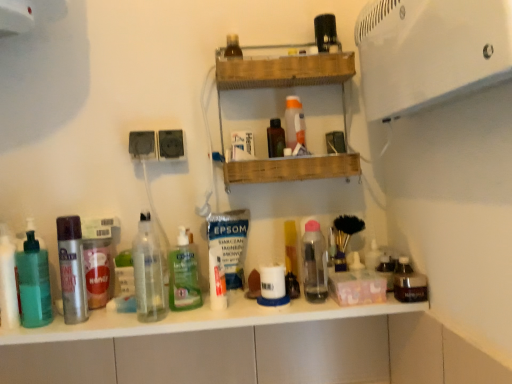
Question: Considering the relative sizes of clear glass bottle at center, the 3th bottle from the left, and silver metallic spray can at left, marked as the fourth bottle in a right-to-left arrangement, in the image provided, is clear glass bottle at center, the 3th bottle from the left, bigger than silver metallic spray can at left, marked as the fourth bottle in a right-to-left arrangement,?

Choices:
 (A) yes
 (B) no

Answer: (A)

Question: Is clear glass bottle at center, the third bottle viewed from the right, placed right next to silver metallic spray can at left, marked as the fourth bottle in a right-to-left arrangement?

Choices:
 (A) yes
 (B) no

Answer: (B)

Question: From a real-world perspective, is clear glass bottle at center, the third bottle viewed from the right, under silver metallic spray can at left, placed as the second bottle when sorted from left to right?

Choices:
 (A) no
 (B) yes

Answer: (A)

Question: Can you confirm if clear glass bottle at center, the third bottle viewed from the right, is smaller than silver metallic spray can at left, placed as the second bottle when sorted from left to right?

Choices:
 (A) yes
 (B) no

Answer: (B)

Question: Is clear glass bottle at center, the third bottle viewed from the right, at the right side of silver metallic spray can at left, placed as the second bottle when sorted from left to right?

Choices:
 (A) yes
 (B) no

Answer: (A)

Question: Is wooden shelf at upper center bigger or smaller than white glossy counter top at center?

Choices:
 (A) small
 (B) big

Answer: (B)

Question: Considering their positions, is wooden shelf at upper center located in front of or behind white glossy counter top at center?

Choices:
 (A) behind
 (B) front

Answer: (A)

Question: Is wooden shelf at upper center inside the boundaries of white glossy counter top at center, or outside?

Choices:
 (A) outside
 (B) inside

Answer: (A)

Question: Would you say wooden shelf at upper center is to the left or to the right of white glossy counter top at center in the picture?

Choices:
 (A) left
 (B) right

Answer: (B)

Question: Is white plastic jar at center, the 1th toiletry positioned from the right, in front of or behind clear glass bottle at center, the 3th bottle from the left, in the image?

Choices:
 (A) behind
 (B) front

Answer: (A)

Question: From the image's perspective, is white plastic jar at center, the 1th toiletry positioned from the right, located above or below clear glass bottle at center, the 3th bottle from the left?

Choices:
 (A) below
 (B) above

Answer: (A)

Question: Considering the positions of white plastic jar at center, the fourth toiletry in the top-to-bottom sequence, and clear glass bottle at center, the third bottle viewed from the right, in the image, is white plastic jar at center, the fourth toiletry in the top-to-bottom sequence, bigger or smaller than clear glass bottle at center, the third bottle viewed from the right,?

Choices:
 (A) big
 (B) small

Answer: (B)

Question: Is point click(x=280, y=304) closer or farther from the camera than point click(x=162, y=278)?

Choices:
 (A) farther
 (B) closer

Answer: (A)

Question: Considering the positions of translucent green pump bottle at left, marked as the 1th toiletry in a left-to-right arrangement, and wooden shelf at upper center in the image, is translucent green pump bottle at left, marked as the 1th toiletry in a left-to-right arrangement, bigger or smaller than wooden shelf at upper center?

Choices:
 (A) big
 (B) small

Answer: (B)

Question: In terms of width, does translucent green pump bottle at left, which appears as the second toiletry when viewed from the top, look wider or thinner when compared to wooden shelf at upper center?

Choices:
 (A) wide
 (B) thin

Answer: (B)